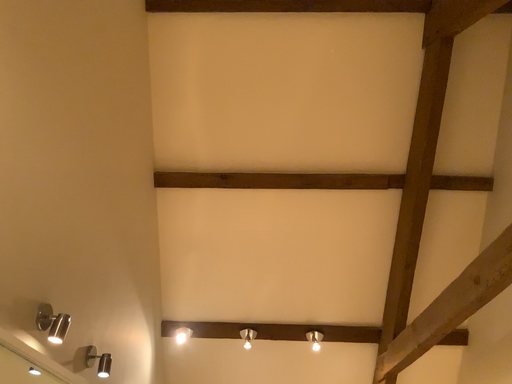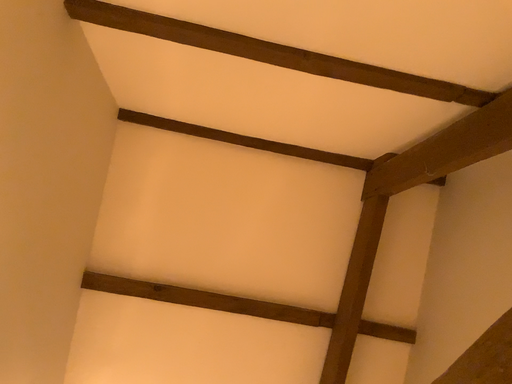
Question: Which way did the camera rotate in the video?

Choices:
 (A) rotated upward
 (B) rotated downward

Answer: (A)